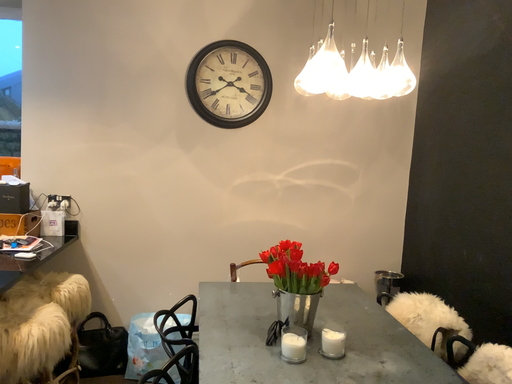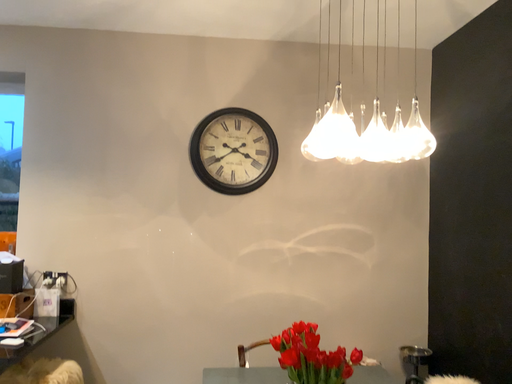
Question: How did the camera likely rotate when shooting the video?

Choices:
 (A) rotated downward
 (B) rotated upward

Answer: (B)